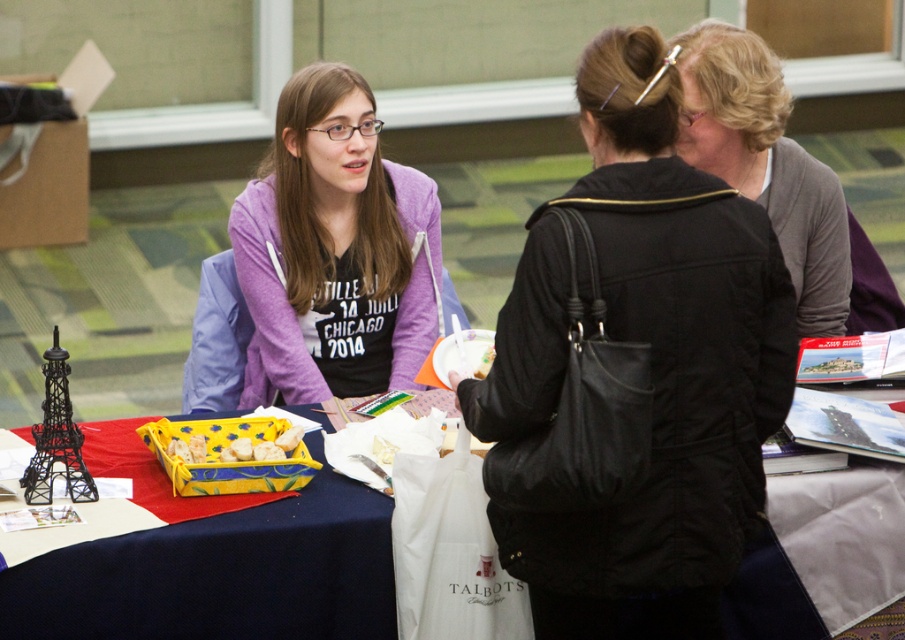
You are a delivery person who needs to place a small package between the black matte eiffel tower at left and the yellow fabric basket at center on the table. The package is 12 inches long. Is there enough space between them to fit the package?

The black matte eiffel tower at left is 15.04 inches away from the yellow fabric basket at center. Since the package is 12 inches long, there is enough space between them to fit the package.

You are a photographer trying to capture a candid shot of the scene. The black leather jacket at center and the blue fabric table at center are both in your viewfinder. Which object will appear larger in the photo?

The black leather jacket at center will appear larger in the photo because it is much taller than the blue fabric table at center.